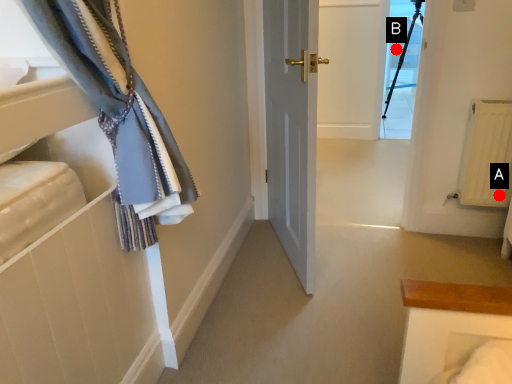
Question: Two points are circled on the image, labeled by A and B beside each circle. Among these points, which one is farthest from the camera?

Choices:
 (A) A is further
 (B) B is further

Answer: (B)